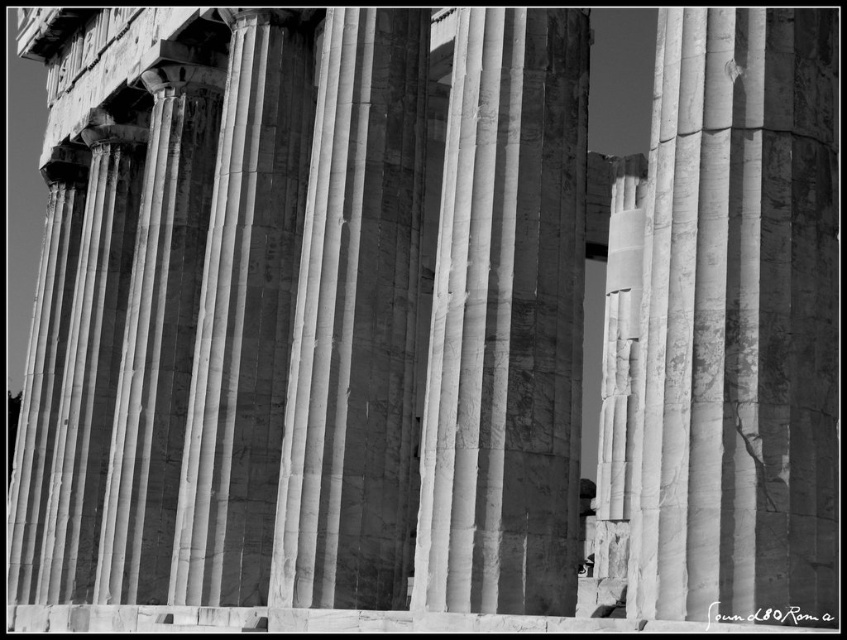
You are an architect examining the photograph of the ancient columns. You notice two columns labeled as smooth marble column at center and white marble column at center. Which of these two columns is positioned lower in the image?

The smooth marble column at center is located below the white marble column at center, so it is positioned lower in the image.